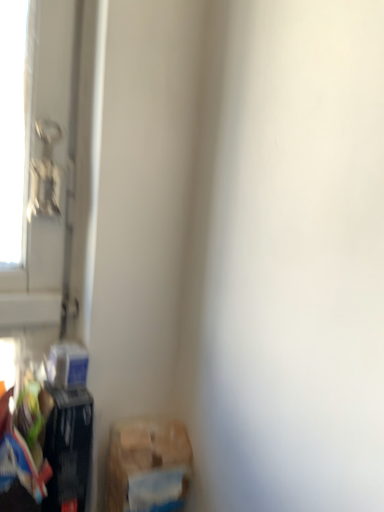
Question: Is matte black trash can at lower left, marked as the second waste in a right-to-left arrangement, bigger or smaller than brown cardboard box at lower left, positioned as the 2th waste in left-to-right order?

Choices:
 (A) small
 (B) big

Answer: (A)

Question: From the image's perspective, is matte black trash can at lower left, marked as the second waste in a right-to-left arrangement, located above or below brown cardboard box at lower left, positioned as the first waste in right-to-left order?

Choices:
 (A) above
 (B) below

Answer: (A)

Question: From their relative heights in the image, would you say matte black trash can at lower left, marked as the second waste in a right-to-left arrangement, is taller or shorter than brown cardboard box at lower left, positioned as the 2th waste in left-to-right order?

Choices:
 (A) tall
 (B) short

Answer: (A)

Question: Which is correct: brown cardboard box at lower left, positioned as the 2th waste in left-to-right order, is inside matte black trash can at lower left, marked as the first waste in a left-to-right arrangement, or outside of it?

Choices:
 (A) outside
 (B) inside

Answer: (A)

Question: From the image's perspective, is brown cardboard box at lower left, positioned as the 2th waste in left-to-right order, positioned above or below matte black trash can at lower left, marked as the first waste in a left-to-right arrangement?

Choices:
 (A) below
 (B) above

Answer: (A)

Question: Visually, is brown cardboard box at lower left, positioned as the 2th waste in left-to-right order, positioned to the left or to the right of matte black trash can at lower left, marked as the second waste in a right-to-left arrangement?

Choices:
 (A) right
 (B) left

Answer: (A)

Question: Does point (180, 425) appear closer or farther from the camera than point (36, 382)?

Choices:
 (A) farther
 (B) closer

Answer: (A)